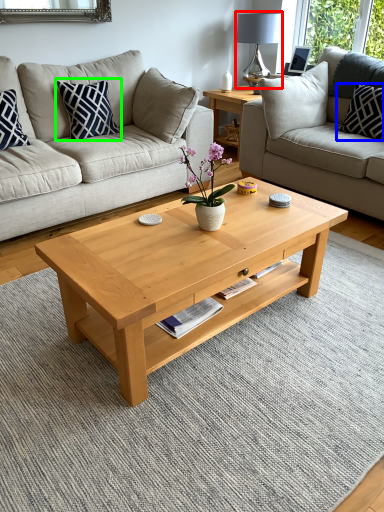
Question: Based on their relative distances, which object is farther from lamp (highlighted by a red box)? Choose from pillow (highlighted by a blue box) and pillow (highlighted by a green box).

Choices:
 (A) pillow
 (B) pillow

Answer: (B)